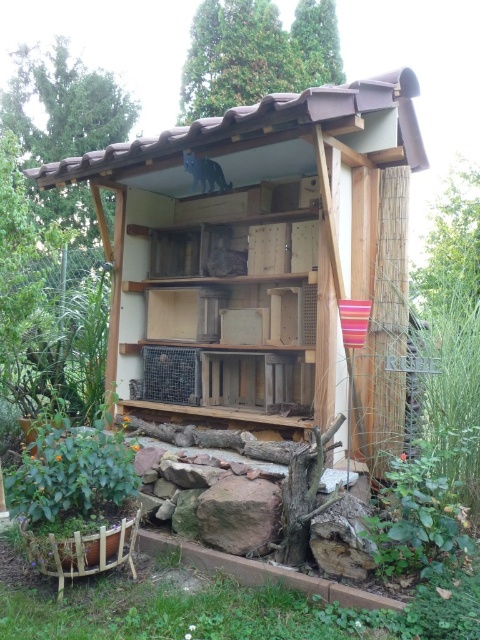
Question: Which point appears farthest from the camera in this image?

Choices:
 (A) (229, 477)
 (B) (327, 157)

Answer: (B)

Question: Is wooden birdhouse at center thinner than brown rough rock at lower center?

Choices:
 (A) yes
 (B) no

Answer: (B)

Question: Which point is closer to the camera?

Choices:
 (A) (148, 307)
 (B) (251, 492)

Answer: (B)

Question: Which point is farther from the camera taking this photo?

Choices:
 (A) (321, 362)
 (B) (252, 531)

Answer: (A)

Question: Does wooden birdhouse at center lie in front of brown rough rock at lower center?

Choices:
 (A) yes
 (B) no

Answer: (A)

Question: Is wooden birdhouse at center below brown rough rock at lower center?

Choices:
 (A) yes
 (B) no

Answer: (B)